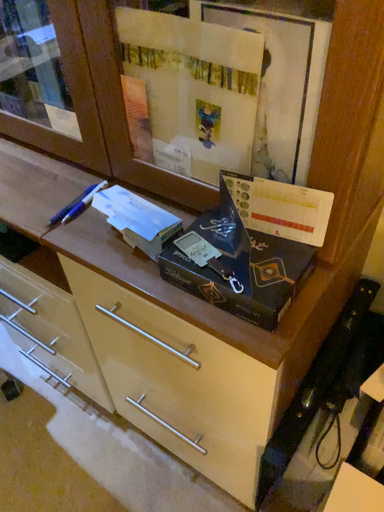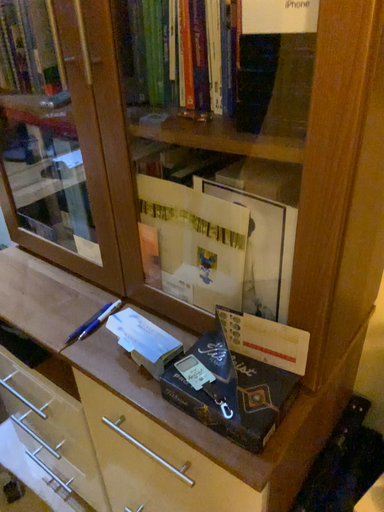
Question: Which way did the camera rotate in the video?

Choices:
 (A) rotated upward
 (B) rotated downward

Answer: (A)